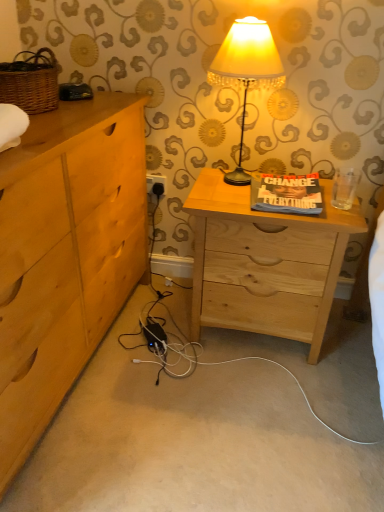
Question: Would you say light wood chest of drawers at left is outside white plastic electric outlet at lower center?

Choices:
 (A) no
 (B) yes

Answer: (B)

Question: Is light wood chest of drawers at left to the right of white plastic electric outlet at lower center from the viewer's perspective?

Choices:
 (A) yes
 (B) no

Answer: (B)

Question: Is light wood chest of drawers at left aimed at white plastic electric outlet at lower center?

Choices:
 (A) no
 (B) yes

Answer: (A)

Question: Would you consider light wood chest of drawers at left to be distant from white plastic electric outlet at lower center?

Choices:
 (A) no
 (B) yes

Answer: (A)

Question: Can you confirm if light wood chest of drawers at left is thinner than white plastic electric outlet at lower center?

Choices:
 (A) no
 (B) yes

Answer: (A)

Question: Looking at their shapes, would you say matte cream lampshade at center is wider or thinner than natural wood nightstand at center?

Choices:
 (A) thin
 (B) wide

Answer: (A)

Question: Is point (256, 73) positioned closer to the camera than point (195, 208)?

Choices:
 (A) farther
 (B) closer

Answer: (B)

Question: From a real-world perspective, relative to natural wood nightstand at center, is matte cream lampshade at center vertically above or below?

Choices:
 (A) above
 (B) below

Answer: (A)

Question: Based on their positions, is matte cream lampshade at center located to the left or right of natural wood nightstand at center?

Choices:
 (A) right
 (B) left

Answer: (B)

Question: In the image, is light wood chest of drawers at left on the left side or the right side of matte cream lampshade at center?

Choices:
 (A) right
 (B) left

Answer: (B)

Question: Is light wood chest of drawers at left bigger or smaller than matte cream lampshade at center?

Choices:
 (A) big
 (B) small

Answer: (A)

Question: From a real-world perspective, is light wood chest of drawers at left physically located above or below matte cream lampshade at center?

Choices:
 (A) below
 (B) above

Answer: (A)

Question: From the image's perspective, relative to matte cream lampshade at center, is light wood chest of drawers at left above or below?

Choices:
 (A) above
 (B) below

Answer: (B)

Question: Considering the relative positions of matte cream lampshade at center and white plastic electric outlet at lower center in the image provided, is matte cream lampshade at center to the left or to the right of white plastic electric outlet at lower center?

Choices:
 (A) left
 (B) right

Answer: (B)

Question: From a real-world perspective, is matte cream lampshade at center positioned above or below white plastic electric outlet at lower center?

Choices:
 (A) below
 (B) above

Answer: (B)